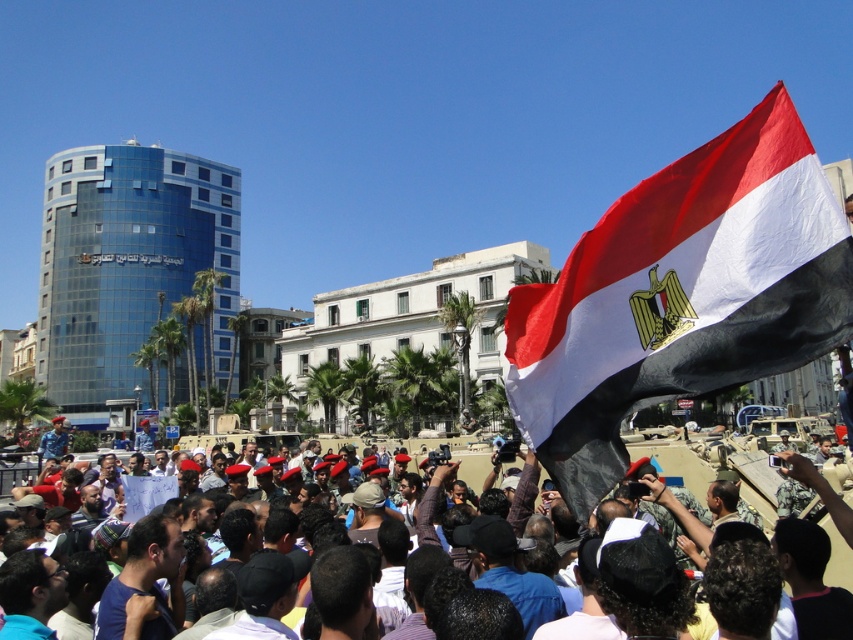
You are a photographer standing in the crowd and want to capture both the point at coordinates point (x=596, y=321) and point (x=759, y=467) in your photo. Which point should you focus on first to ensure both are in clear view?

You should focus on point (x=596, y=321) first since it is closer to the viewer than point (x=759, y=467). This ensures both points remain in focus as the depth of field will cover the farther point.